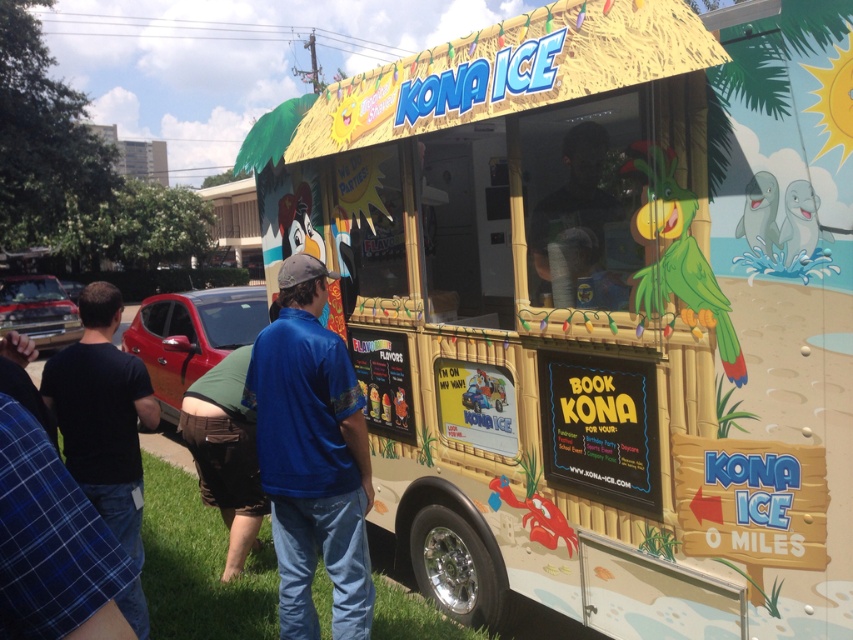
The image size is (853, 640). Describe the element at coordinates (596, 308) in the screenshot. I see `beige bamboo food truck at center` at that location.

Does beige bamboo food truck at center appear on the right side of matte black shirt at center?

Incorrect, beige bamboo food truck at center is not on the right side of matte black shirt at center.

Is point (613, 528) less distant than point (619, 289)?

That is True.

Find the location of `beige bamboo food truck at center`. beige bamboo food truck at center is located at coordinates (596, 308).

Which is above, beige bamboo food truck at center or black cotton shirt at lower left?

beige bamboo food truck at center is higher up.

Does point (560, 118) lie behind point (99, 282)?

No, it is not.

Is point (717, 157) more distant than point (109, 385)?

That is False.

This screenshot has height=640, width=853. In order to click on beige bamboo food truck at center in this screenshot , I will do `click(596, 308)`.

Does blue denim jeans at lower center have a greater width compared to matte black shirt at center?

A: Indeed, blue denim jeans at lower center has a greater width compared to matte black shirt at center.

Between blue denim jeans at lower center and matte black shirt at center, which one is positioned higher?

matte black shirt at center is above.

Who is more forward, (314, 307) or (585, 154)?

Point (314, 307) is in front.

The height and width of the screenshot is (640, 853). Identify the location of blue denim jeans at lower center. (312, 456).